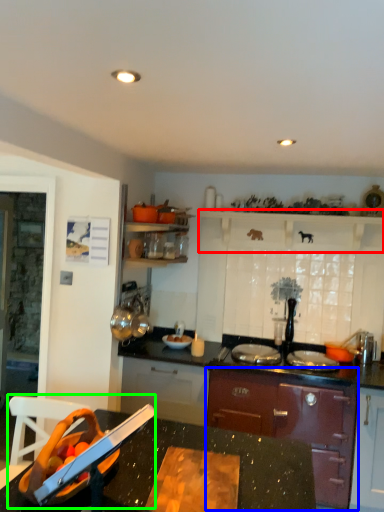
Question: Which object is positioned closest to shelf (highlighted by a red box)? Select from cabinetry (highlighted by a blue box) and sink (highlighted by a green box).

Choices:
 (A) cabinetry
 (B) sink

Answer: (A)